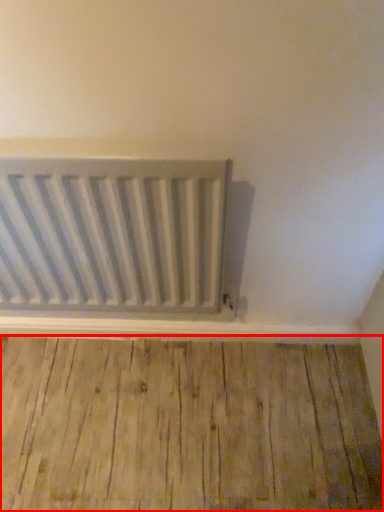
Question: From the image's perspective, considering the relative positions of hardwood (annotated by the red box) and radiator in the image provided, where is hardwood (annotated by the red box) located with respect to the staircase?

Choices:
 (A) above
 (B) below

Answer: (B)